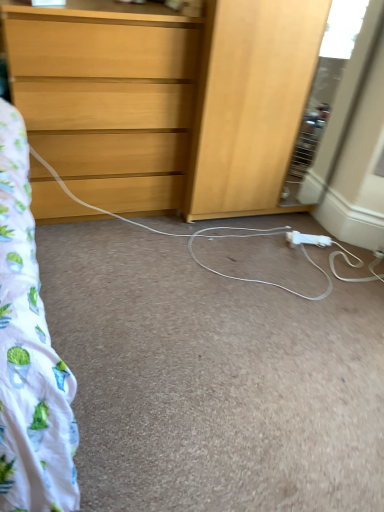
Question: Is light wood chest of drawers at upper left in front of or behind white plastic extension cord at lower center in the image?

Choices:
 (A) behind
 (B) front

Answer: (B)

Question: From their relative heights in the image, would you say light wood chest of drawers at upper left is taller or shorter than white plastic extension cord at lower center?

Choices:
 (A) short
 (B) tall

Answer: (B)

Question: In the image, is light wood chest of drawers at upper left on the left side or the right side of white plastic extension cord at lower center?

Choices:
 (A) right
 (B) left

Answer: (B)

Question: Is white plastic extension cord at lower center inside or outside of light wood chest of drawers at upper left?

Choices:
 (A) inside
 (B) outside

Answer: (B)

Question: From a real-world perspective, is white plastic extension cord at lower center physically located above or below light wood chest of drawers at upper left?

Choices:
 (A) above
 (B) below

Answer: (B)

Question: Considering the positions of white plastic extension cord at lower center and light wood chest of drawers at upper left in the image, is white plastic extension cord at lower center wider or thinner than light wood chest of drawers at upper left?

Choices:
 (A) thin
 (B) wide

Answer: (A)

Question: From the image's perspective, relative to light wood chest of drawers at upper left, is white plastic extension cord at lower center above or below?

Choices:
 (A) above
 (B) below

Answer: (B)